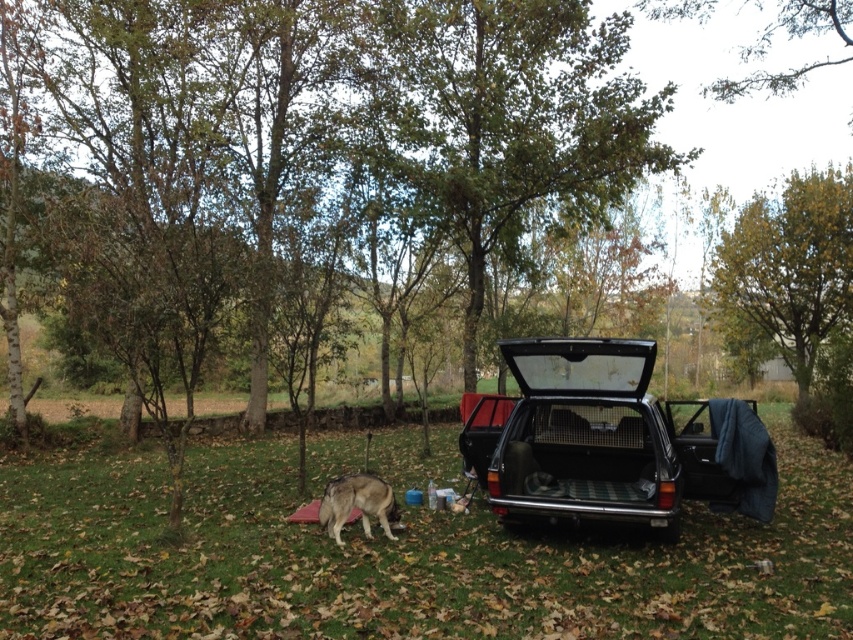
Is point (564, 502) positioned before point (321, 518)?

Yes, it is in front of point (321, 518).

Can you confirm if black matte car at right is thinner than fuzzy brown dog at lower left?

No, black matte car at right is not thinner than fuzzy brown dog at lower left.

Is point (749, 426) positioned behind point (392, 497)?

Yes, it is behind point (392, 497).

You are a GUI agent. You are given a task and a screenshot of the screen. Output one action in this format:
    pyautogui.click(x=<x>, y=<y>)
    Task: Click on the black matte car at right
    
    Given the screenshot: What is the action you would take?
    pyautogui.click(x=612, y=440)